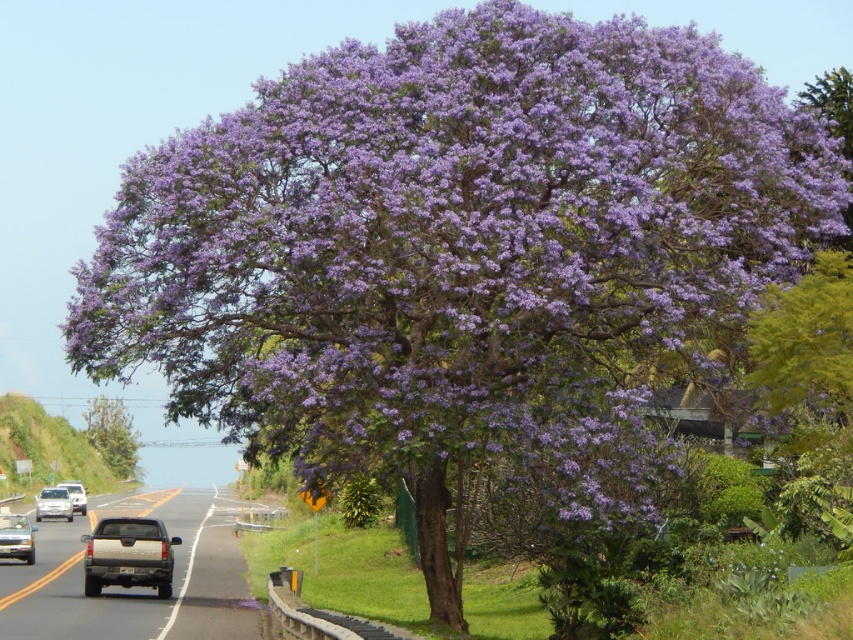
Looking at this image, you are a delivery driver planning to pass through the road in the image. You notice a gold metallic truck at center and a white matte truck at center. Which truck do you need to be cautious about when assessing road width for your vehicle?

The gold metallic truck at center might be wider than the white matte truck at center, so you should be cautious of the gold metallic truck at center when assessing road width for your vehicle.

You are a pedestrian standing at the edge of the road and see both the gray metallic truck at center and the gold metallic truck at center. Which truck is nearer to you?

The gray metallic truck at center is closer to the viewer than the gold metallic truck at center, so the gray metallic truck at center is nearer to you.